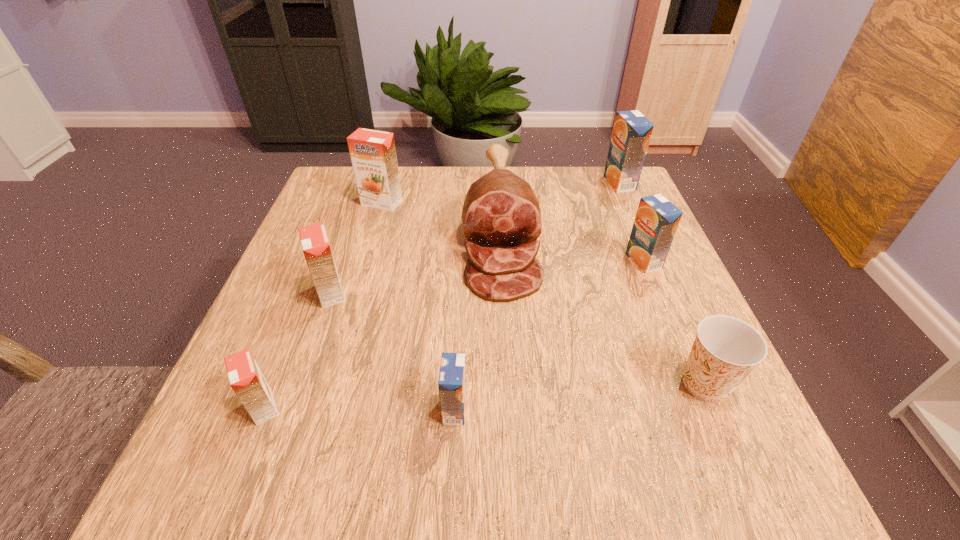
Identify the location of vacant region located 0.360m on the left of the nearest blue orange_juice. The height and width of the screenshot is (540, 960). (214, 409).

The width and height of the screenshot is (960, 540). What are the coordinates of `ham that is positioned at the far edge` in the screenshot? It's located at (501, 213).

Find the location of `Dixie cup located in the right edge section of the desktop`. Dixie cup located in the right edge section of the desktop is located at coordinates (726, 349).

Locate an element on the screen. The image size is (960, 540). object that is at the far left corner is located at coordinates (373, 154).

The width and height of the screenshot is (960, 540). I want to click on object located at the far right corner, so click(x=632, y=131).

You are a GUI agent. You are given a task and a screenshot of the screen. Output one action in this format:
    pyautogui.click(x=<x>, y=<y>)
    Task: Click on the free space at the far edge of the desktop
    
    Given the screenshot: What is the action you would take?
    pyautogui.click(x=441, y=166)

The height and width of the screenshot is (540, 960). In the image, there is a desktop. What are the coordinates of `vacant area at the near edge` in the screenshot? It's located at (348, 439).

Where is `free space at the left edge of the desktop`? free space at the left edge of the desktop is located at coordinates (278, 384).

Locate an element on the screen. vacant region at the right edge is located at coordinates (613, 287).

You are a GUI agent. You are given a task and a screenshot of the screen. Output one action in this format:
    pyautogui.click(x=<x>, y=<y>)
    Task: Click on the free space at the far left corner
    This screenshot has height=540, width=960.
    Given the screenshot: What is the action you would take?
    pyautogui.click(x=351, y=173)